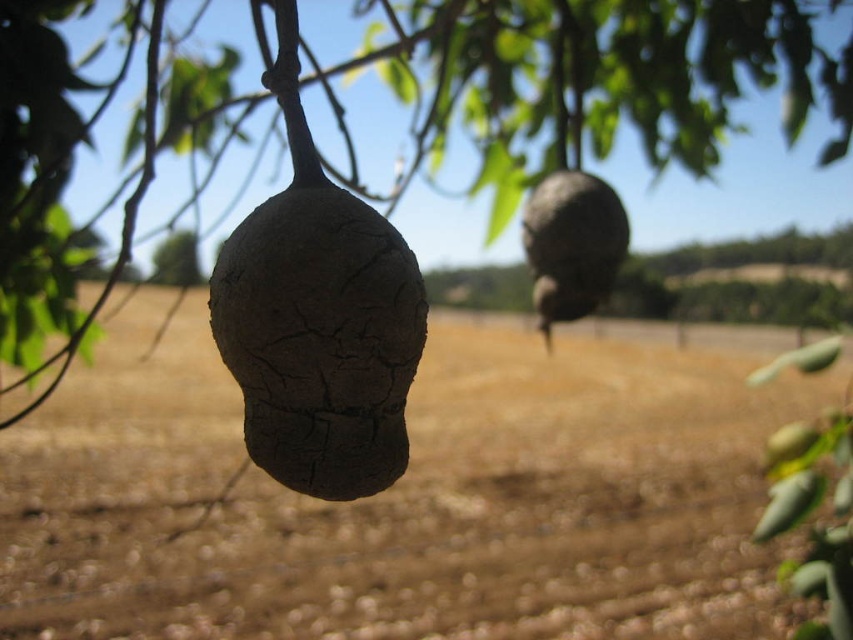
Identify the location of cracked brown fruit at center. The width and height of the screenshot is (853, 640). (320, 339).

Which is more to the right, cracked brown fruit at center or leathery brown pod at center?

leathery brown pod at center is more to the right.

Who is more distant from viewer, [332,420] or [549,252]?

Point [549,252]

At what (x,y) coordinates should I click in order to perform the action: click on cracked brown fruit at center. Please return your answer as a coordinate pair (x, y). Looking at the image, I should click on (320, 339).

In the scene shown: Is brown soil at center to the left of cracked brown fruit at center from the viewer's perspective?

Incorrect, brown soil at center is not on the left side of cracked brown fruit at center.

Does brown soil at center have a lesser height compared to cracked brown fruit at center?

Incorrect, brown soil at center's height does not fall short of cracked brown fruit at center's.

Between point (692, 493) and point (219, 324), which one is positioned in front?

Point (219, 324)

The height and width of the screenshot is (640, 853). I want to click on brown soil at center, so click(403, 499).

Identify the location of brown soil at center. (403, 499).

Is brown soil at center above leathery brown pod at center?

Incorrect, brown soil at center is not positioned above leathery brown pod at center.

Where is `brown soil at center`? The width and height of the screenshot is (853, 640). brown soil at center is located at coordinates (403, 499).

Identify the location of brown soil at center. (403, 499).